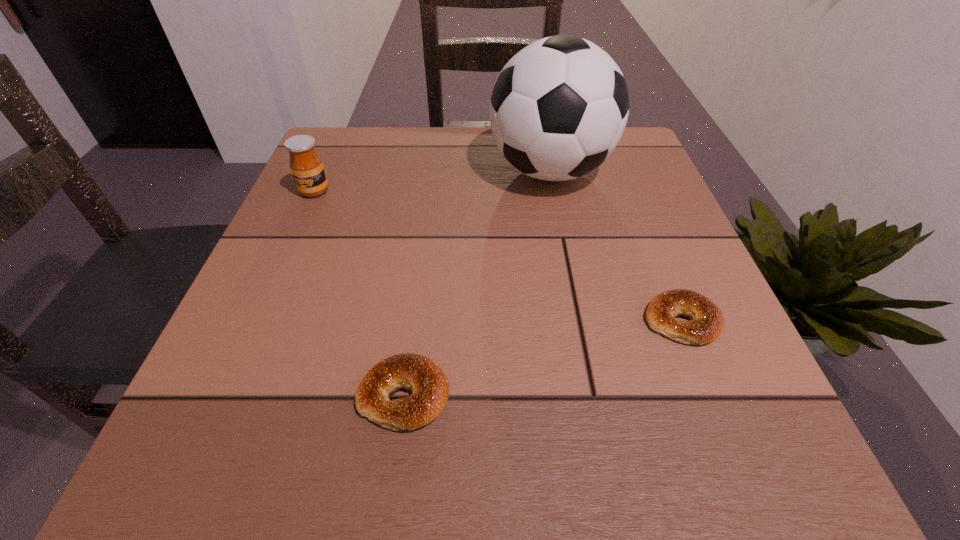
This screenshot has height=540, width=960. Identify the location of soccer ball. (558, 109).

The image size is (960, 540). I want to click on the leftmost object, so click(306, 165).

Identify the location of honey. This screenshot has width=960, height=540. coord(306,165).

Find the location of a particular element. The width and height of the screenshot is (960, 540). the nearer bagel is located at coordinates (430, 387).

Find the location of a particular element. The width and height of the screenshot is (960, 540). the nearest object is located at coordinates (430, 387).

Locate an element on the screen. The image size is (960, 540). the right bagel is located at coordinates (707, 322).

Where is `the second nearest object`? The image size is (960, 540). the second nearest object is located at coordinates (707, 322).

This screenshot has height=540, width=960. Identify the location of vacant area situated on the right of the tallest object. (639, 171).

The image size is (960, 540). I want to click on vacant space located 0.230m on the front-facing side of the third shortest object, so click(274, 285).

The height and width of the screenshot is (540, 960). Find the location of `vacant point located on the right of the left bagel`. vacant point located on the right of the left bagel is located at coordinates (564, 395).